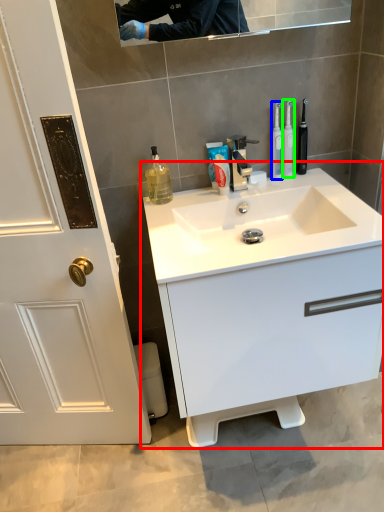
Question: Considering the real-world distances, which object is closest to bathroom cabinet (highlighted by a red box)? mouthwash (highlighted by a blue box) or toothbrush (highlighted by a green box).

Choices:
 (A) mouthwash
 (B) toothbrush

Answer: (A)